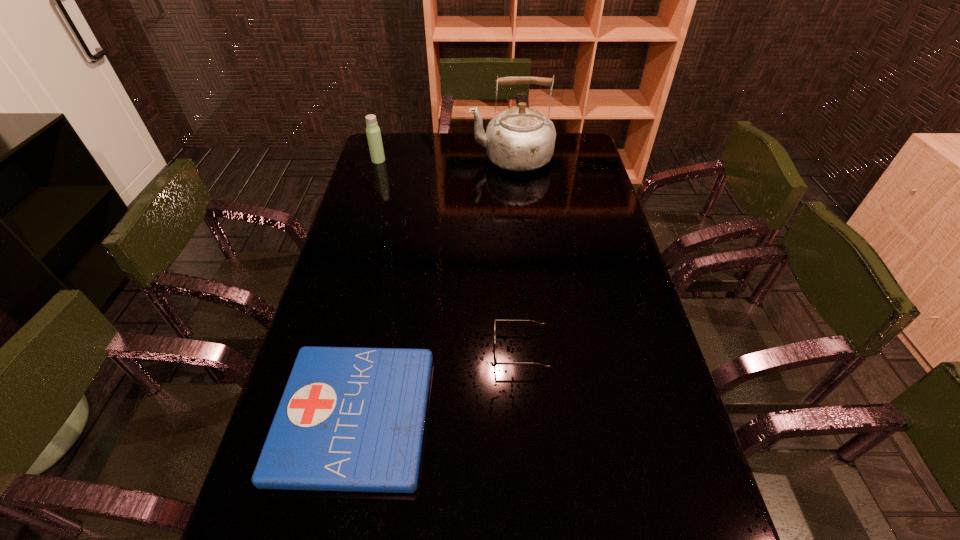
Find the location of a particular element. Image resolution: width=960 pixels, height=540 pixels. vacant position located 0.270m on the front lenses of the sunglasses is located at coordinates (391, 350).

Identify the location of vacant region located 0.230m on the right of the shortest object. The image size is (960, 540). (527, 416).

Locate an element on the screen. The image size is (960, 540). kettle located in the far edge section of the desktop is located at coordinates (519, 139).

Find the location of a particular element. Image resolution: width=960 pixels, height=540 pixels. thermos bottle at the far edge is located at coordinates (373, 133).

Identify the location of thermos bottle that is at the left edge. (373, 133).

At what (x,y) coordinates should I click in order to perform the action: click on the first-aid kit that is at the left edge. Please return your answer as a coordinate pair (x, y). Looking at the image, I should click on (352, 419).

The height and width of the screenshot is (540, 960). I want to click on object that is positioned at the far left corner, so click(x=373, y=133).

Where is `vacant space at the far edge`? Image resolution: width=960 pixels, height=540 pixels. vacant space at the far edge is located at coordinates (462, 150).

Where is `free point at the left edge`? The height and width of the screenshot is (540, 960). free point at the left edge is located at coordinates (331, 319).

This screenshot has height=540, width=960. I want to click on vacant region at the right edge, so click(578, 179).